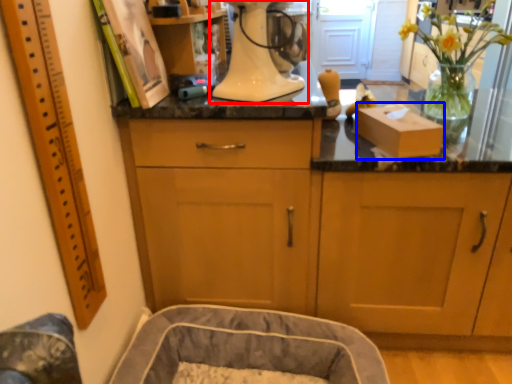
Question: Which object appears closest to the camera in this image, home appliance (highlighted by a red box) or cardboard box (highlighted by a blue box)?

Choices:
 (A) home appliance
 (B) cardboard box

Answer: (A)